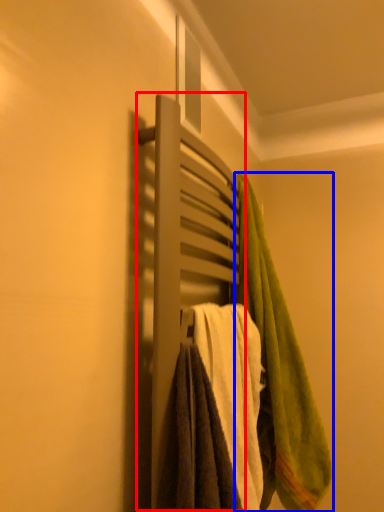
Question: Which of the following is the closest to the observer, closet (highlighted by a red box) or towel (highlighted by a blue box)?

Choices:
 (A) closet
 (B) towel

Answer: (A)